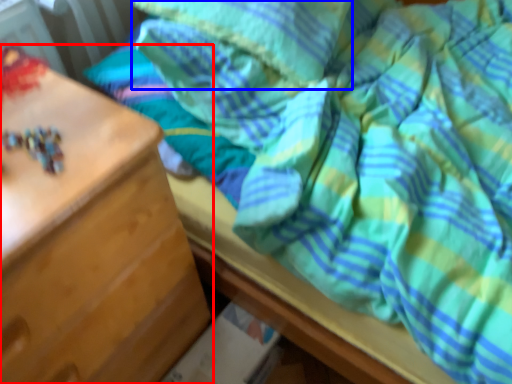
Question: Which point is further to the camera, chest of drawers (highlighted by a red box) or pillow (highlighted by a blue box)?

Choices:
 (A) chest of drawers
 (B) pillow

Answer: (B)